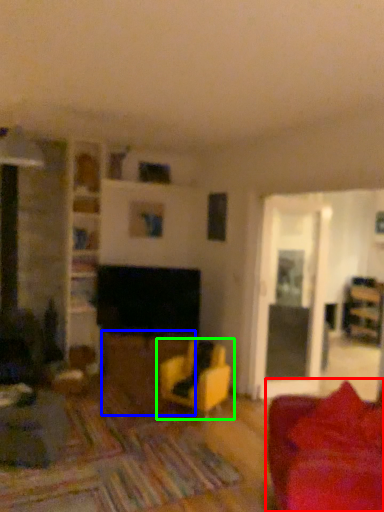
Question: Considering the real-world distances, which object is farthest from studio couch (highlighted by a red box)? table (highlighted by a blue box) or chair (highlighted by a green box)?

Choices:
 (A) table
 (B) chair

Answer: (A)